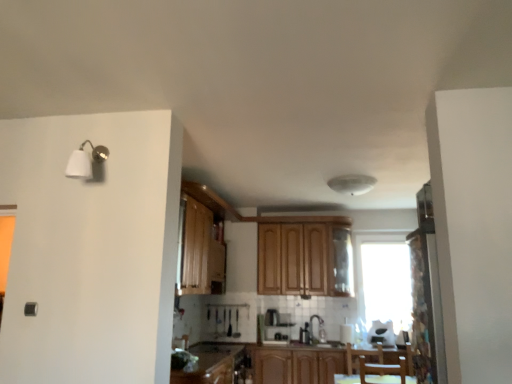
Question: In the image, is white glossy toaster at center positioned in front of or behind brown wooden chair at lower center?

Choices:
 (A) front
 (B) behind

Answer: (B)

Question: In terms of height, does white glossy toaster at center look taller or shorter compared to brown wooden chair at lower center?

Choices:
 (A) short
 (B) tall

Answer: (A)

Question: Estimate the real-world distances between objects in this image. Which object is closer to the wooden cabinet at center, which appears as the 1th cabinetry when viewed from the top?

Choices:
 (A) patterned fabric screen door at right
 (B) wooden cabinet at lower center, arranged as the second cabinetry when ordered from the bottom
 (C) satin silver coffee machine at center
 (D) brown wooden chair at lower center
 (E) white matte wall sconce at upper left

Answer: (C)

Question: Which is nearer to the wooden cabinets at center, positioned as the 3th cabinetry in top-to-bottom order?

Choices:
 (A) wooden cabinet at center, which appears as the 1th cabinetry when viewed from the top
 (B) wooden cabinet at lower center, which is the second cabinetry from top to bottom
 (C) satin silver coffee machine at center
 (D) white glossy toaster at center
 (E) white glossy sink at center

Answer: (B)